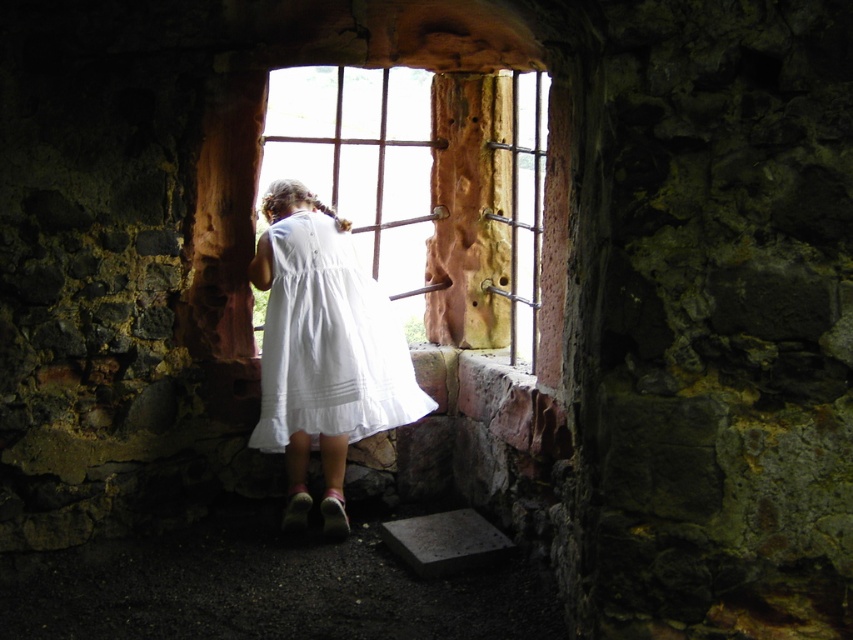
Question: Where is wooden at center located in relation to white cotton dress at center in the image?

Choices:
 (A) left
 (B) right

Answer: (B)

Question: Which object is farther from the camera taking this photo?

Choices:
 (A) wooden at center
 (B) white cotton dress at center

Answer: (B)

Question: Can you confirm if wooden at center is smaller than white cotton dress at center?

Choices:
 (A) no
 (B) yes

Answer: (A)

Question: Is wooden at center to the right of white cotton dress at center from the viewer's perspective?

Choices:
 (A) yes
 (B) no

Answer: (A)